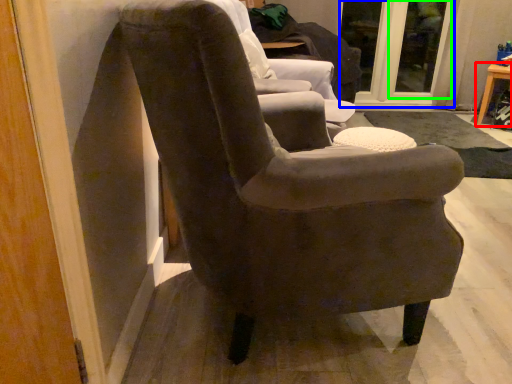
Question: Considering the real-world distances, which object is closest to table (highlighted by a red box)? glass door (highlighted by a blue box) or glass door (highlighted by a green box).

Choices:
 (A) glass door
 (B) glass door

Answer: (B)